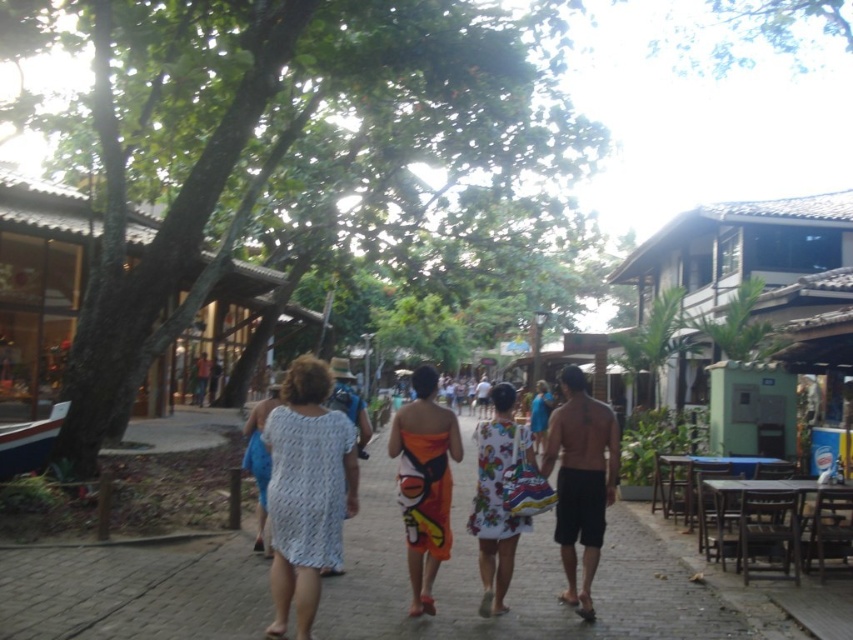
Based on the photo, you are standing at the center of the pathway and see a point at coordinates (x=424, y=483). Which object is this point located on?

The point at coordinates (x=424, y=483) is located on the orange printed sarong at center.

You are standing at the starting point of your journey and see the brown cobblestone pavement at center. According to the map, your destination is at coordinates point 0.906, 0.601. Are you currently standing on the correct path to reach your destination?

Yes, since the brown cobblestone pavement at center is located at point (512, 579), you are currently standing on the correct path to reach your destination.

You are a photographer trying to capture a photo of both the orange printed sarong at center and the white printed dress at center in the same frame. The camera you are using has a maximum focus range of 3 feet. Will you be able to include both items in your photo?

The orange printed sarong at center and white printed dress at center are 3.33 feet apart from each other. Since the camera can only focus within 3 feet, the distance between them exceeds the focus range. Therefore, you won t be able to include both in the same focused photo.